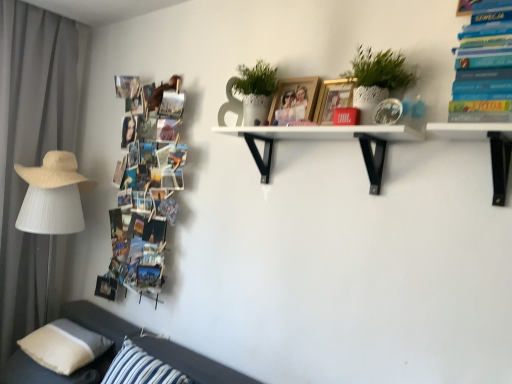
Question: Is wooden photo frame at upper center, acting as the second picture frame starting from the front, in front of or behind white matte shelf at center in the image?

Choices:
 (A) front
 (B) behind

Answer: (B)

Question: Based on their sizes in the image, would you say wooden photo frame at upper center, acting as the first picture frame starting from the back, is bigger or smaller than white matte shelf at center?

Choices:
 (A) small
 (B) big

Answer: (A)

Question: Which is nearer to the gray fabric curtain at left?

Choices:
 (A) beige fabric pillow at lower left, which ranks as the 1th pillow in left-to-right order
 (B) wooden photo frame at upper center, acting as the first picture frame starting from the back
 (C) wooden photo collage at left, which is the first book from left to right
 (D) white matte shelf at center
 (E) beige straw hat at left

Answer: (E)

Question: Estimate the real-world distances between objects in this image. Which object is farther from the wooden photo collage at left, which is the first book from left to right?

Choices:
 (A) hardcover book at upper right, placed as the 2th book when sorted from back to front
 (B) gray fabric curtain at left
 (C) white textured pot at upper center
 (D) beige fabric pillow at lower left, which is the 2th pillow from right to left
 (E) striped fabric pillow at lower left, which ranks as the first pillow in right-to-left order

Answer: (A)